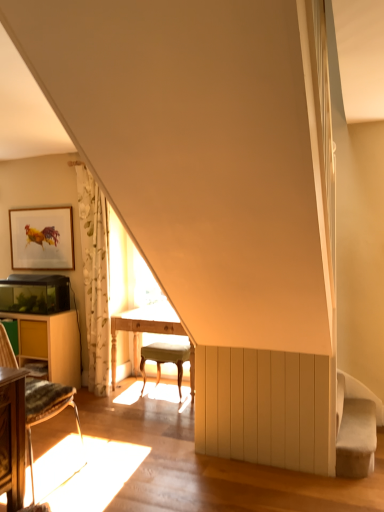
Question: In the image, is light wood table at center, which appears as the 2th table when viewed from the left, on the left side or the right side of wooden chair at lower left?

Choices:
 (A) right
 (B) left

Answer: (A)

Question: Relative to wooden chair at lower left, is light wood table at center, which is counted as the first table, starting from the right, in front or behind?

Choices:
 (A) front
 (B) behind

Answer: (B)

Question: Estimate the real-world distances between objects in this image. Which object is farther from the light beige fabric stool at center?

Choices:
 (A) wooden table at left, the 1th table when ordered from left to right
 (B) velvet beige swivel chair at lower right
 (C) light wood table at center, which is counted as the first table, starting from the right
 (D) wooden chair at lower left
 (E) gold-framed artwork at upper left

Answer: (E)

Question: Which object is positioned farthest from the velvet beige swivel chair at lower right?

Choices:
 (A) white floral fabric curtain at left
 (B) gold-framed artwork at upper left
 (C) wooden chair at lower left
 (D) light beige fabric stool at center
 (E) light wood table at center, which appears as the 2th table when viewed from the left

Answer: (B)